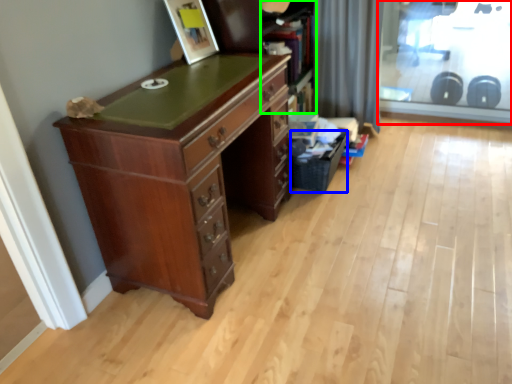
Question: Estimate the real-world distances between objects in this image. Which object is closer to screen door (highlighted by a red box), basket (highlighted by a blue box) or bookshelf (highlighted by a green box)?

Choices:
 (A) basket
 (B) bookshelf

Answer: (B)